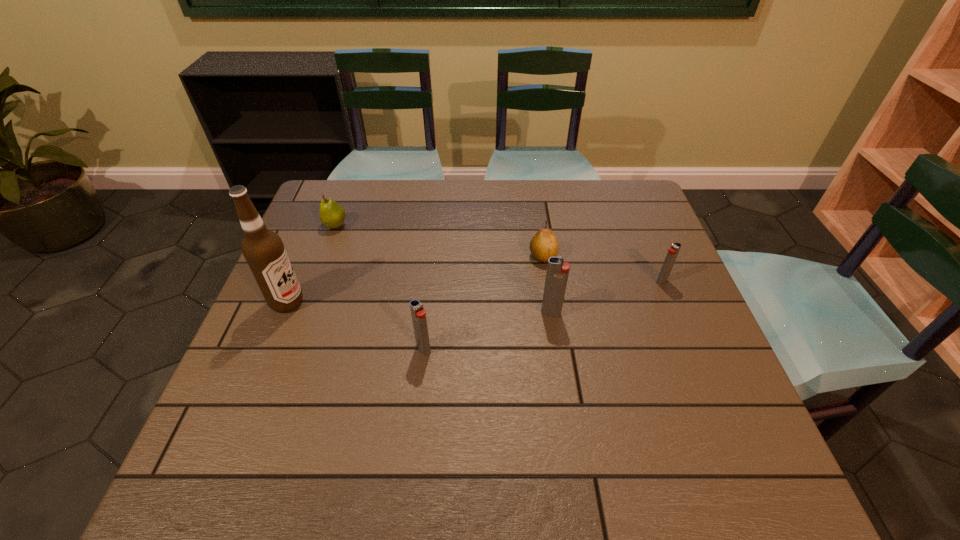
All igniters are currently evenly spaced. To continue this pattern, where would you add another igniter on the left? Please point out a vacant spot. Please provide its 2D coordinates. Your answer should be formatted as a tuple, i.e. [(x, y)], where the tuple contains the x and y coordinates of a point satisfying the conditions above.

[(276, 392)]